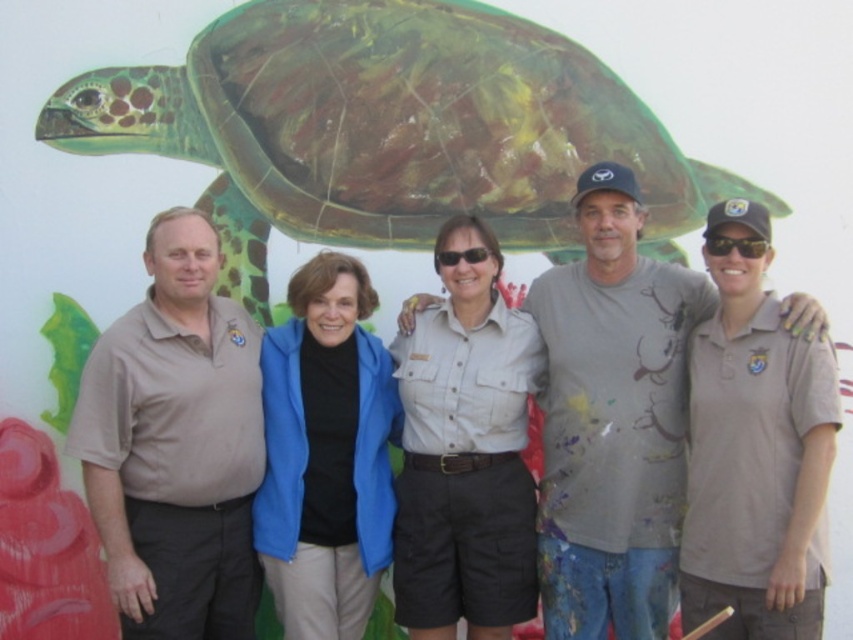
Between brown cotton polo shirt at left and blue fleece jacket at center, which one is positioned lower?

blue fleece jacket at center

Is brown cotton polo shirt at left below blue fleece jacket at center?

No, brown cotton polo shirt at left is not below blue fleece jacket at center.

Is point (178, 541) in front of point (364, 273)?

That is False.

This screenshot has width=853, height=640. I want to click on brown cotton polo shirt at left, so click(x=175, y=444).

This screenshot has height=640, width=853. What are the coordinates of `green painted shell at upper center` in the screenshot? It's located at (375, 124).

Find the location of a particular element. The image size is (853, 640). green painted shell at upper center is located at coordinates (375, 124).

Is matte khaki polo shirt at center to the left of khaki uniform shirt at center from the viewer's perspective?

No, matte khaki polo shirt at center is not to the left of khaki uniform shirt at center.

What do you see at coordinates (755, 451) in the screenshot?
I see `matte khaki polo shirt at center` at bounding box center [755, 451].

Does point (807, 371) lie in front of point (216, 189)?

That is True.

Image resolution: width=853 pixels, height=640 pixels. I want to click on matte khaki polo shirt at center, so click(x=755, y=451).